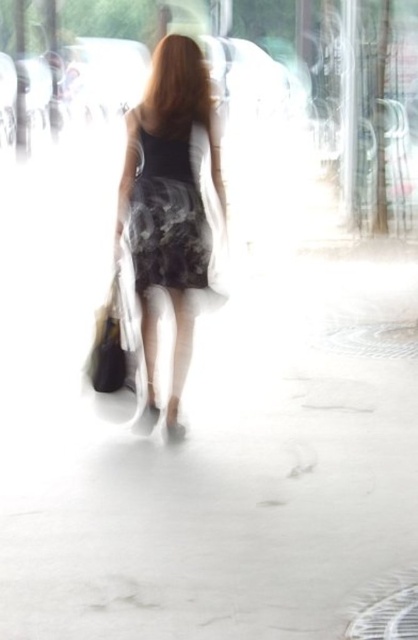
What are the coordinates of `floral dress at center` in the screenshot? It's located at (168, 205).

Which is in front, point (191, 282) or point (160, 163)?

Positioned in front is point (160, 163).

The height and width of the screenshot is (640, 418). I want to click on floral dress at center, so click(168, 205).

Can you confirm if floral-patterned fabric dress at center is wider than blonde silky hair at upper center?

Correct, the width of floral-patterned fabric dress at center exceeds that of blonde silky hair at upper center.

Who is more distant from viewer, (173, 228) or (168, 44)?

Point (173, 228)

Locate an element on the screen. The height and width of the screenshot is (640, 418). floral-patterned fabric dress at center is located at coordinates (167, 218).

Is floral dress at center closer to the viewer compared to blonde silky hair at upper center?

Yes, floral dress at center is in front of blonde silky hair at upper center.

Locate an element on the screen. The width and height of the screenshot is (418, 640). floral dress at center is located at coordinates (168, 205).